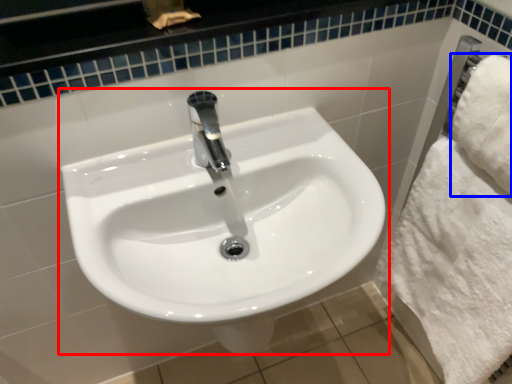
Question: Which object is further to the camera taking this photo, sink (highlighted by a red box) or bath towel (highlighted by a blue box)?

Choices:
 (A) sink
 (B) bath towel

Answer: (B)